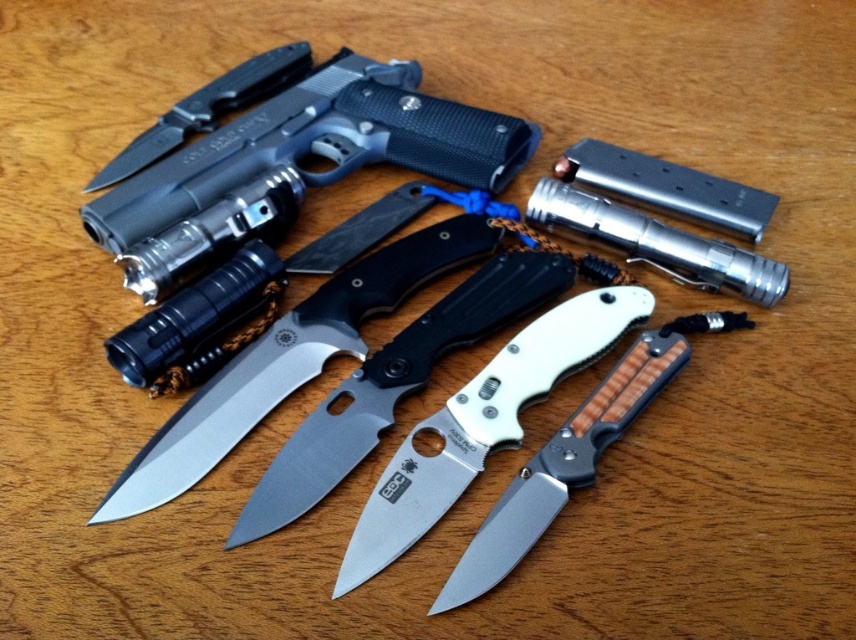
Question: Is silver metallic knife at center thinner than silver metallic folding knife at center?

Choices:
 (A) yes
 (B) no

Answer: (B)

Question: Can you confirm if silver metallic knife at center is positioned below matte black knife at center?

Choices:
 (A) no
 (B) yes

Answer: (B)

Question: Which object is the farthest from the satin finish knife at center?

Choices:
 (A) silver metallic knife at center
 (B) matte black knife at center
 (C) silver metallic folding knife at center

Answer: (B)

Question: Which of the following is the farthest from the observer?

Choices:
 (A) (479, 440)
 (B) (397, 291)
 (C) (180, 116)

Answer: (C)

Question: Which of these objects is positioned farthest from the satin finish knife at center?

Choices:
 (A) matte black knife at center
 (B) silver metallic folding knife at center
 (C) silver metallic knife at center

Answer: (A)

Question: Can you confirm if silver metallic folding knife at center is positioned above matte black knife at center?

Choices:
 (A) yes
 (B) no

Answer: (B)